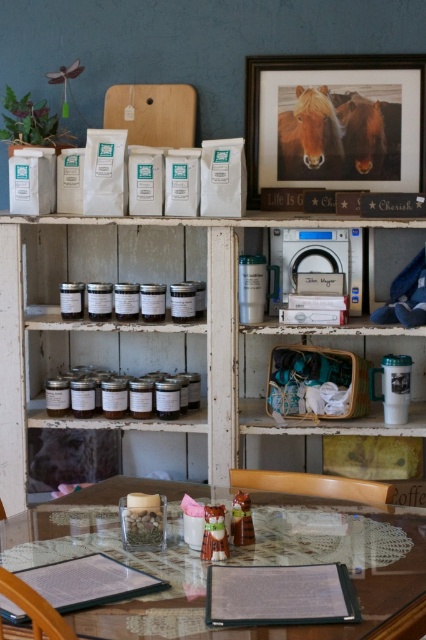
Can you confirm if wooden framed picture at upper center is positioned below wooden chair at lower left?

Actually, wooden framed picture at upper center is above wooden chair at lower left.

Based on the photo, between wooden framed picture at upper center and wooden chair at lower left, which one has less height?

wooden chair at lower left

At what (x,y) coordinates should I click in order to perform the action: click on wooden framed picture at upper center. Please return your answer as a coordinate pair (x, y). This screenshot has width=426, height=640. Looking at the image, I should click on (334, 122).

Which of these two, white wood pantry at center or clear glass jars at center, stands taller?

Standing taller between the two is white wood pantry at center.

The image size is (426, 640). Find the location of `white wood pantry at center`. white wood pantry at center is located at coordinates (167, 340).

Identify the location of white wood pantry at center. (167, 340).

Does wooden chair at lower left appear over clear glass jars at center?

Incorrect, wooden chair at lower left is not positioned above clear glass jars at center.

Does point (43, 618) come in front of point (204, 337)?

Yes, it is.

Who is more forward, (28, 637) or (192, 419)?

Positioned in front is point (28, 637).

You are a GUI agent. You are given a task and a screenshot of the screen. Output one action in this format:
    pyautogui.click(x=<x>, y=<y>)
    Task: Click on the wooden chair at lower left
    The height and width of the screenshot is (640, 426).
    Given the screenshot: What is the action you would take?
    pyautogui.click(x=31, y=612)